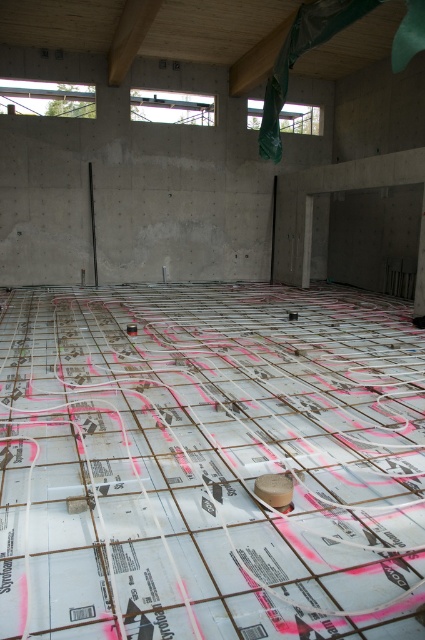
You are an inspector checking the construction site. You notice the white grid concrete at center and the white matte tape at center. Which object is closer to you from your current position?

The white grid concrete at center is closer to you because it is in front of the white matte tape at center.

You are an inspector checking the construction site. You notice the white grid concrete at center and the white matte tape at center. Which object is located to the left of the other?

The white grid concrete at center is positioned on the left side of white matte tape at center.

You are an inspector checking the insulation layout. You notice two items at the center of the image. Which one is bigger in size between the white grid concrete at center and the white matte tape at center?

The white grid concrete at center is larger in size than the white matte tape at center.